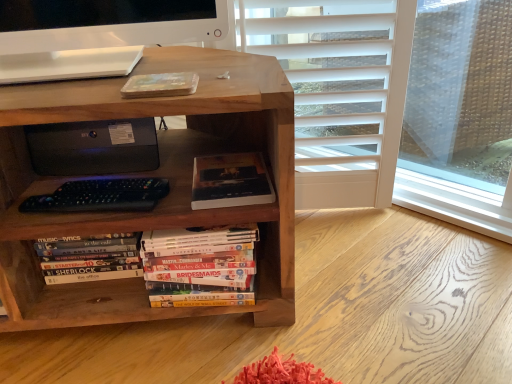
The width and height of the screenshot is (512, 384). What do you see at coordinates (93, 147) in the screenshot?
I see `black matte printer at center` at bounding box center [93, 147].

What do you see at coordinates (155, 176) in the screenshot? I see `wooden bookcase at center` at bounding box center [155, 176].

Where is `dark matte book at center, positioned as the first book in right-to-left order`? The image size is (512, 384). dark matte book at center, positioned as the first book in right-to-left order is located at coordinates (230, 181).

Are black matte printer at center and wooden bookcase at center far apart?

No, black matte printer at center is not far away from wooden bookcase at center.

Is black matte printer at center turned away from wooden bookcase at center?

Yes, wooden bookcase at center is at the back of black matte printer at center.

From the picture: From a real-world perspective, is black matte printer at center on top of wooden bookcase at center?

Yes, from a real-world perspective, black matte printer at center is over wooden bookcase at center

Would you say wooden bookcase at center is part of black matte printer at center's contents?

No.

Which is less distant, (251, 160) or (9, 133)?

Positioned in front is point (9, 133).

Is dark matte book at center, placed as the second book when sorted from left to right, in contact with wooden bookcase at center?

No, dark matte book at center, placed as the second book when sorted from left to right, is not beside wooden bookcase at center.

Is dark matte book at center, the second book ordered from the bottom, positioned with its back to wooden bookcase at center?

Yes, dark matte book at center, the second book ordered from the bottom, is facing away from wooden bookcase at center.

Based on the photo, considering the sizes of objects dark matte book at center, placed as the second book when sorted from left to right, and black matte printer at center in the image provided, who is smaller, dark matte book at center, placed as the second book when sorted from left to right, or black matte printer at center?

dark matte book at center, placed as the second book when sorted from left to right.

Is dark matte book at center, positioned as the first book in right-to-left order, facing away from black matte printer at center?

No, black matte printer at center is not at the back of dark matte book at center, positioned as the first book in right-to-left order.

Is dark matte book at center, the first book positioned from the top, next to black matte printer at center?

No, dark matte book at center, the first book positioned from the top, is not touching black matte printer at center.

Would you say dark matte book at center, positioned as the first book in right-to-left order, is inside or outside black matte printer at center?

dark matte book at center, positioned as the first book in right-to-left order, is located beyond the bounds of black matte printer at center.

What's the angular difference between wooden bookcase at center and hardcover books at lower left, the 2th book when ordered from right to left,'s facing directions?

wooden bookcase at center and hardcover books at lower left, the 2th book when ordered from right to left, are facing 1.28 degrees away from each other.

How distant is wooden bookcase at center from hardcover books at lower left, which is the first book in bottom-to-top order?

7.98 inches.

Is wooden bookcase at center beside hardcover books at lower left, arranged as the first book when viewed from the left?

wooden bookcase at center is not next to hardcover books at lower left, arranged as the first book when viewed from the left, and they're not touching.

Which of these two, wooden bookcase at center or hardcover books at lower left, which is the first book in bottom-to-top order, is wider?

wooden bookcase at center is wider.

Does hardcover books at lower left, arranged as the first book when viewed from the left, touch dark matte book at center, positioned as the first book in right-to-left order?

No, hardcover books at lower left, arranged as the first book when viewed from the left, is not touching dark matte book at center, positioned as the first book in right-to-left order.

Between hardcover books at lower left, the 2th book when ordered from right to left, and dark matte book at center, the first book positioned from the top, which one has more height?

With more height is hardcover books at lower left, the 2th book when ordered from right to left.

Is dark matte book at center, positioned as the first book in right-to-left order, surrounded by hardcover books at lower left, positioned as the 2th book in top-to-bottom order?

No, hardcover books at lower left, positioned as the 2th book in top-to-bottom order, does not contain dark matte book at center, positioned as the first book in right-to-left order.

Based on the photo, is wooden bookcase at center beside dark matte book at center, the first book positioned from the top?

wooden bookcase at center and dark matte book at center, the first book positioned from the top, are not in contact.

Is wooden bookcase at center in front of dark matte book at center, the second book ordered from the bottom?

Yes, wooden bookcase at center is in front of dark matte book at center, the second book ordered from the bottom.

From a real-world perspective, is wooden bookcase at center over dark matte book at center, positioned as the first book in right-to-left order?

No, from a real-world perspective, wooden bookcase at center is not above dark matte book at center, positioned as the first book in right-to-left order.

From the image's perspective, does wooden bookcase at center appear lower than dark matte book at center, positioned as the first book in right-to-left order?

Incorrect, from the image's perspective, wooden bookcase at center is higher than dark matte book at center, positioned as the first book in right-to-left order.

Consider the image. From the image's perspective, is dark matte book at center, placed as the second book when sorted from left to right, above hardcover books at lower left, which is the first book in bottom-to-top order?

Yes, from the image's perspective, dark matte book at center, placed as the second book when sorted from left to right, is above hardcover books at lower left, which is the first book in bottom-to-top order.

Does dark matte book at center, positioned as the first book in right-to-left order, have a greater height compared to hardcover books at lower left, positioned as the 2th book in top-to-bottom order?

No.

Between dark matte book at center, the second book ordered from the bottom, and hardcover books at lower left, positioned as the 2th book in top-to-bottom order, which one has larger width?

dark matte book at center, the second book ordered from the bottom.

Find the location of `printer on the right of wooden bookcase at center`. printer on the right of wooden bookcase at center is located at coordinates (93, 147).

I want to click on book that is the 1st object located below the wooden bookcase at center (from the image's perspective), so click(230, 181).

Considering their positions, is wooden bookcase at center positioned closer to hardcover books at lower left, the 2th book when ordered from right to left, than dark matte book at center, positioned as the first book in right-to-left order?

Based on the image, wooden bookcase at center appears to be nearer to hardcover books at lower left, the 2th book when ordered from right to left.

Estimate the real-world distances between objects in this image. Which object is closer to black matte printer at center, hardcover books at lower left, positioned as the 2th book in top-to-bottom order, or dark matte book at center, the first book positioned from the top?

hardcover books at lower left, positioned as the 2th book in top-to-bottom order.

When comparing their distances from dark matte book at center, the first book positioned from the top, does black matte printer at center or hardcover books at lower left, positioned as the 2th book in top-to-bottom order, seem closer?

Among the two, black matte printer at center is located nearer to dark matte book at center, the first book positioned from the top.

When comparing their distances from wooden bookcase at center, does dark matte book at center, positioned as the first book in right-to-left order, or black matte printer at center seem further?

The object further to wooden bookcase at center is black matte printer at center.

Looking at the image, which one is located closer to wooden bookcase at center, hardcover books at lower left, positioned as the 2th book in top-to-bottom order, or black matte printer at center?

Among the two, black matte printer at center is located nearer to wooden bookcase at center.

Which object lies nearer to the anchor point black matte printer at center, wooden bookcase at center or dark matte book at center, the second book ordered from the bottom?

wooden bookcase at center is closer to black matte printer at center.

Estimate the real-world distances between objects in this image. Which object is further from hardcover books at lower left, positioned as the 2th book in top-to-bottom order, wooden bookcase at center or black matte printer at center?

wooden bookcase at center is further to hardcover books at lower left, positioned as the 2th book in top-to-bottom order.

Based on their spatial positions, is dark matte book at center, placed as the second book when sorted from left to right, or black matte printer at center further from hardcover books at lower left, the 2th book when ordered from right to left?

dark matte book at center, placed as the second book when sorted from left to right, lies further to hardcover books at lower left, the 2th book when ordered from right to left, than the other object.

The height and width of the screenshot is (384, 512). I want to click on book situated between wooden bookcase at center and dark matte book at center, the second book ordered from the bottom, from left to right, so coord(90,258).

Find the location of a particular element. printer situated between hardcover books at lower left, arranged as the first book when viewed from the left, and dark matte book at center, the second book ordered from the bottom, from left to right is located at coordinates (93, 147).

I want to click on printer between wooden bookcase at center and hardcover books at lower left, positioned as the 2th book in top-to-bottom order, in the front-back direction, so click(93, 147).

Find the location of `printer between wooden bookcase at center and dark matte book at center, positioned as the first book in right-to-left order`. printer between wooden bookcase at center and dark matte book at center, positioned as the first book in right-to-left order is located at coordinates (93, 147).